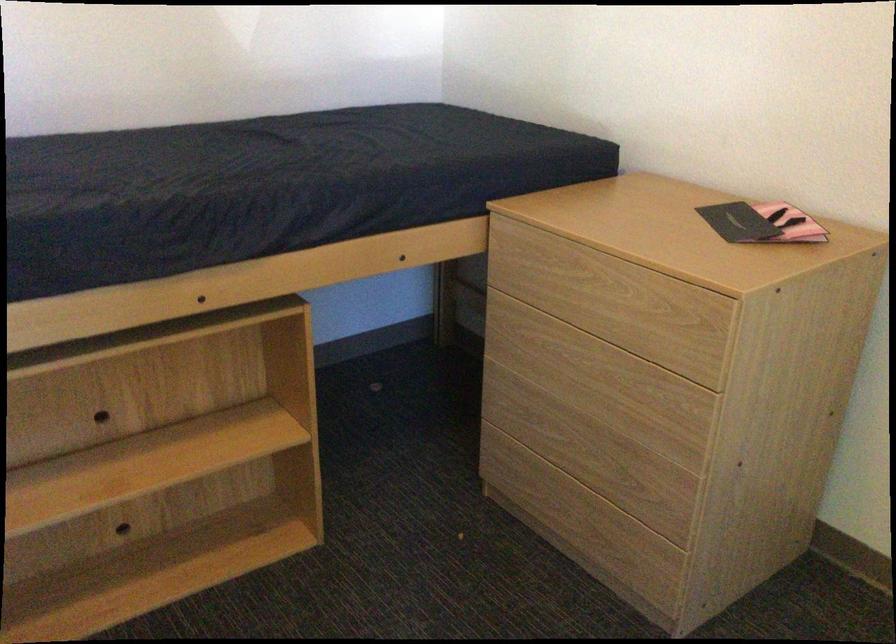
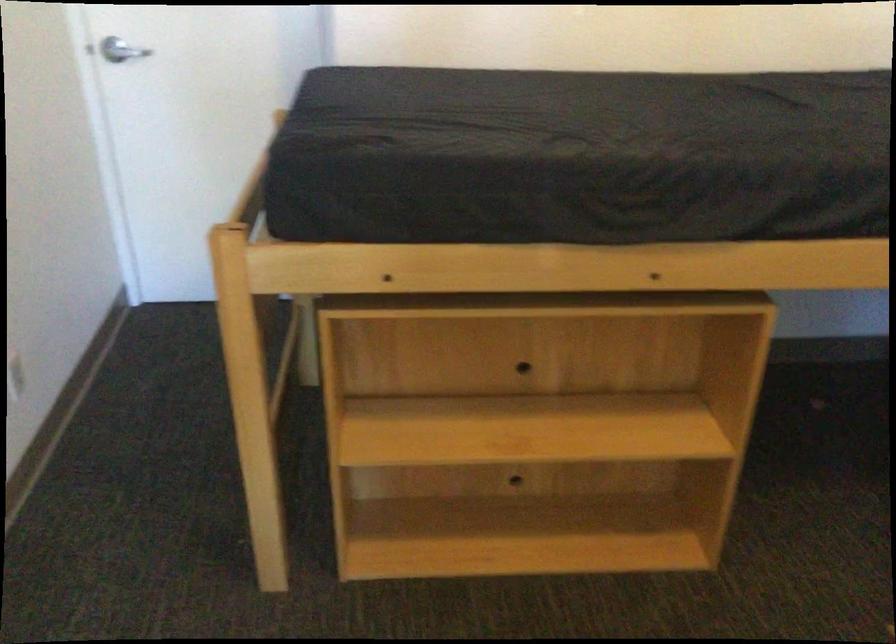
Question: How did the camera likely rotate?

Choices:
 (A) Left
 (B) Right
 (C) Up
 (D) Down

Answer: (A)